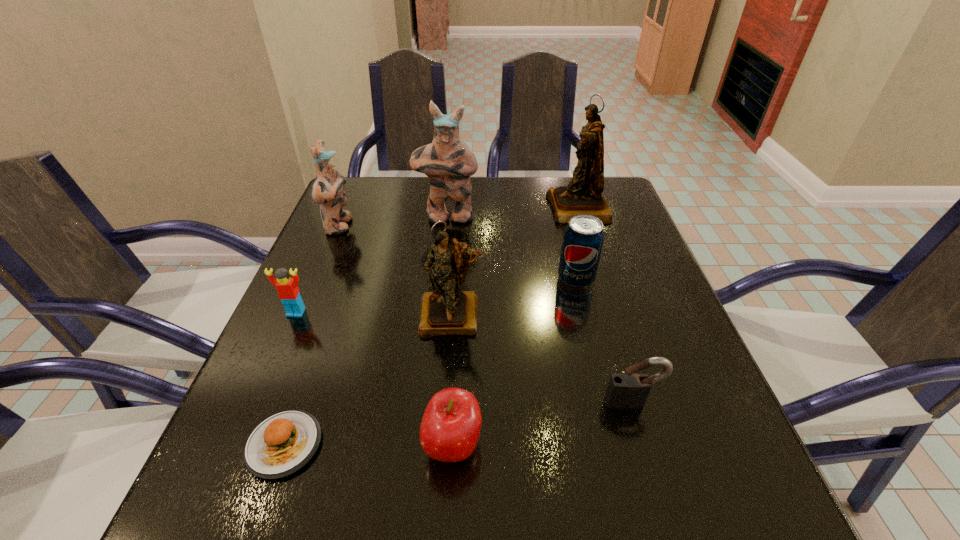
Choose which object is the second nearest neighbor to the red Lego. Please provide its 2D coordinates. Your answer should be formatted as a tuple, i.e. [(x, y)], where the tuple contains the x and y coordinates of a point satisfying the conditions above.

[(446, 311)]

What are the coordinates of `figurine that stands as the second closest to the right pink figurine` in the screenshot? It's located at click(x=583, y=195).

Point out which figurine is positioned as the nearest to the smaller pink figurine. Please provide its 2D coordinates. Your answer should be formatted as a tuple, i.e. [(x, y)], where the tuple contains the x and y coordinates of a point satisfying the conditions above.

[(448, 162)]

Identify the location of free space that satisfies the following two spatial constraints: 1. on the front-facing side of the bigger pink figurine; 2. on the front-facing side of the smaller pink figurine. This screenshot has width=960, height=540. (446, 226).

This screenshot has height=540, width=960. I want to click on free space that satisfies the following two spatial constraints: 1. on the front-facing side of the sixth nearest object; 2. on the left side of the bigger pink figurine, so click(x=441, y=279).

I want to click on free spot that satisfies the following two spatial constraints: 1. on the front-facing side of the left pink figurine; 2. on the right side of the red apple, so click(x=247, y=446).

In order to click on vacant position in the image that satisfies the following two spatial constraints: 1. on the front-facing side of the farther gold figurine; 2. with the keyhole on the front of the seventh farthest object in this screenshot , I will do `click(638, 402)`.

Where is `free space that satisfies the following two spatial constraints: 1. on the front-facing side of the farther gold figurine; 2. on the front side of the sixth nearest object`? free space that satisfies the following two spatial constraints: 1. on the front-facing side of the farther gold figurine; 2. on the front side of the sixth nearest object is located at coordinates click(x=600, y=279).

The height and width of the screenshot is (540, 960). I want to click on blank space that satisfies the following two spatial constraints: 1. on the front-facing side of the left gold figurine; 2. on the left side of the apple, so [x=443, y=446].

Identify the location of free location that satisfies the following two spatial constraints: 1. on the back side of the sixth nearest object; 2. on the left side of the red apple. (461, 279).